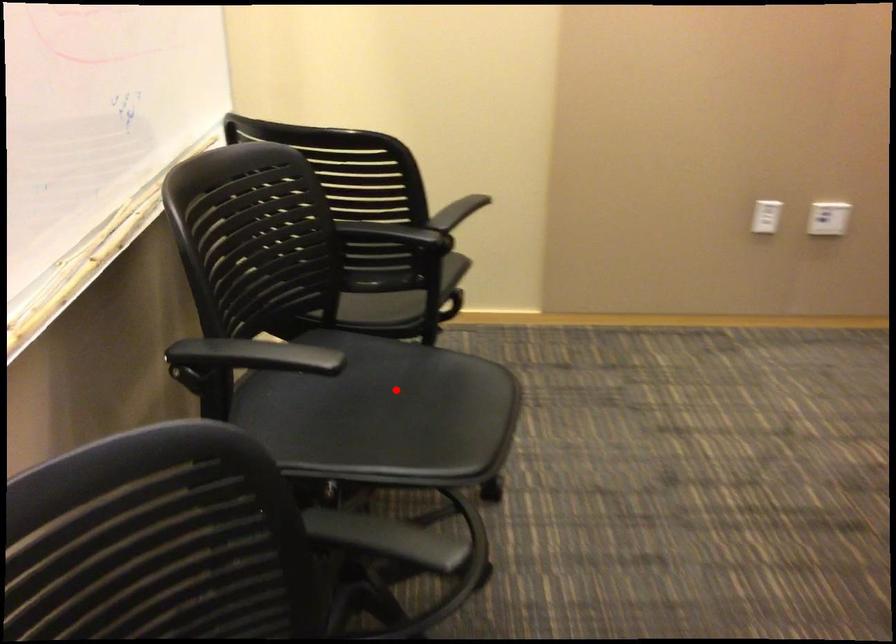
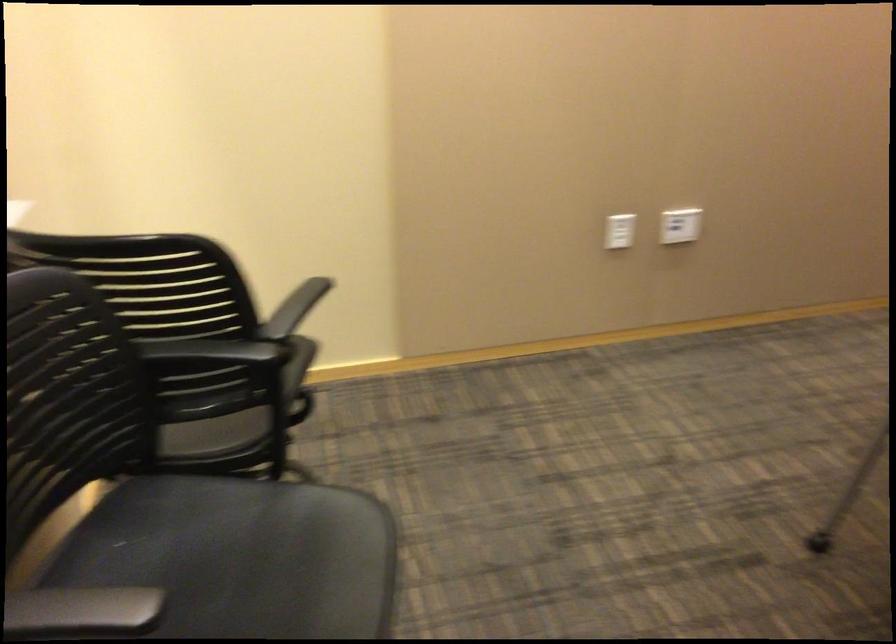
Question: I am providing you with two images of the same scene from different viewpoints. Given a red point in image1, look at the same physical point in image2. Is it:

Choices:
 (A) Closer to the viewpoint
 (B) Farther from the viewpoint

Answer: (A)